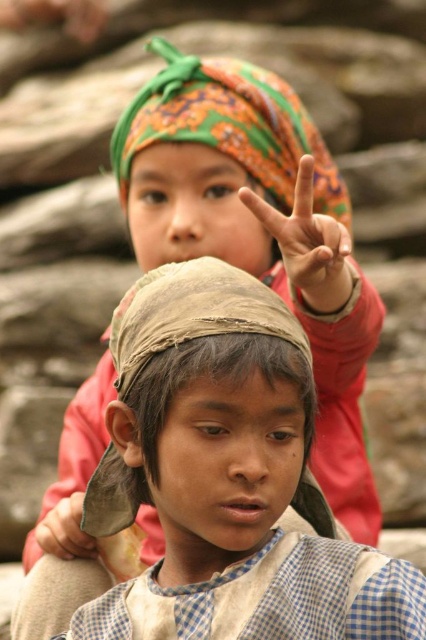
Question: Is matte fabric hand at upper center further to the viewer compared to matte brown hand at center?

Choices:
 (A) no
 (B) yes

Answer: (A)

Question: Among these objects, which one is farthest from the camera?

Choices:
 (A) brown textured cloth at center
 (B) printed fabric headscarf at upper center
 (C) matte fabric hand at upper center
 (D) matte brown hand at center

Answer: (B)

Question: Does printed fabric headscarf at upper center appear on the left side of matte fabric hand at upper center?

Choices:
 (A) yes
 (B) no

Answer: (A)

Question: Which point is closer to the camera taking this photo?

Choices:
 (A) (325, 253)
 (B) (238, 449)
 (C) (270, 170)

Answer: (B)

Question: Estimate the real-world distances between objects in this image. Which object is farther from the brown textured cloth at center?

Choices:
 (A) matte brown hand at center
 (B) matte fabric hand at upper center
 (C) printed fabric headscarf at upper center

Answer: (C)

Question: Does brown textured cloth at center have a greater width compared to matte brown hand at center?

Choices:
 (A) no
 (B) yes

Answer: (B)